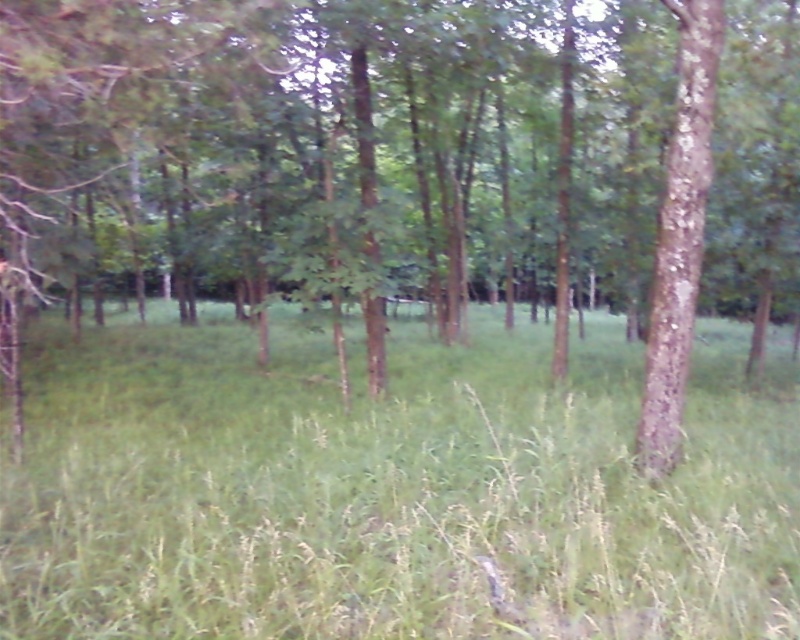
You are standing in the forest scene described. You notice two points marked in the image. Which point, point (690, 522) or point (684, 276), is closer to you?

Point (690, 522) is closer to the camera than point (684, 276).

You are a hiker who wants to place a 3 meter long tent between the green grassy at center and the brown rough bark tree at right. Can you fit the tent there?

The distance between the green grassy at center and the brown rough bark tree at right is 3.36 meters, so yes, the tent can be placed there as it is longer than the tent length.